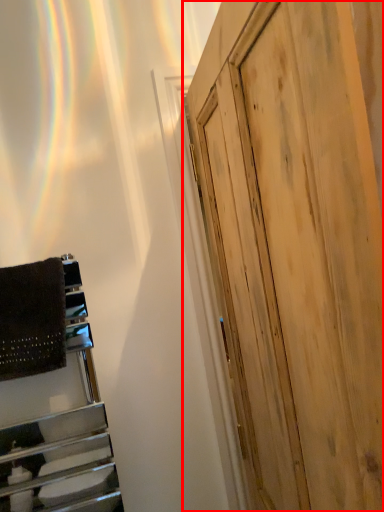
Question: Considering the relative positions of door (annotated by the red box) and blanket in the image provided, where is door (annotated by the red box) located with respect to the staircase?

Choices:
 (A) left
 (B) right

Answer: (B)